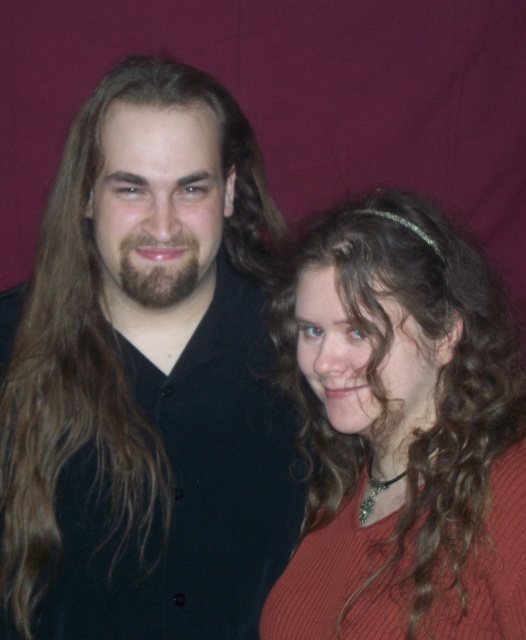
Question: Which of the following is the farthest from the observer?

Choices:
 (A) [x=185, y=236]
 (B) [x=479, y=513]

Answer: (A)

Question: Does matte red sweater at right come behind brownwoollybeard at left?

Choices:
 (A) no
 (B) yes

Answer: (A)

Question: Which of these objects is positioned closest to the matte red sweater at right?

Choices:
 (A) matte black shirt at left
 (B) brownwoollybeard at left

Answer: (A)

Question: Is matte red sweater at right smaller than brownwoollybeard at left?

Choices:
 (A) no
 (B) yes

Answer: (A)

Question: Which object appears closest to the camera in this image?

Choices:
 (A) brownwoollybeard at left
 (B) matte red sweater at right

Answer: (B)

Question: Can you confirm if matte black shirt at left is positioned below matte red sweater at right?

Choices:
 (A) yes
 (B) no

Answer: (B)